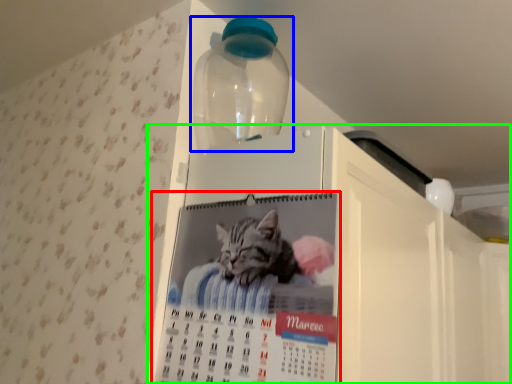
Question: Considering the real-world distances, which object is farthest from poster (highlighted by a red box)? bottle (highlighted by a blue box) or appliance (highlighted by a green box)?

Choices:
 (A) bottle
 (B) appliance

Answer: (A)